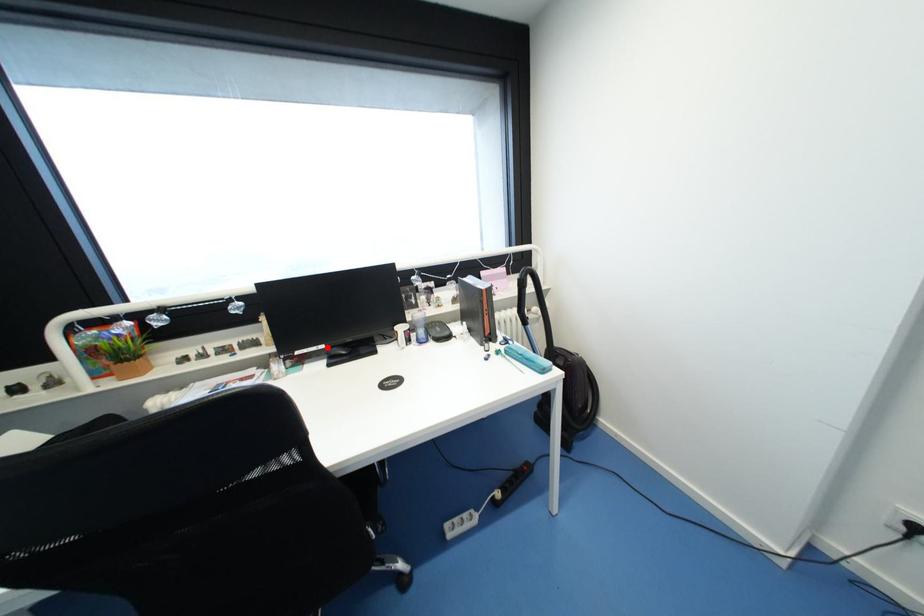
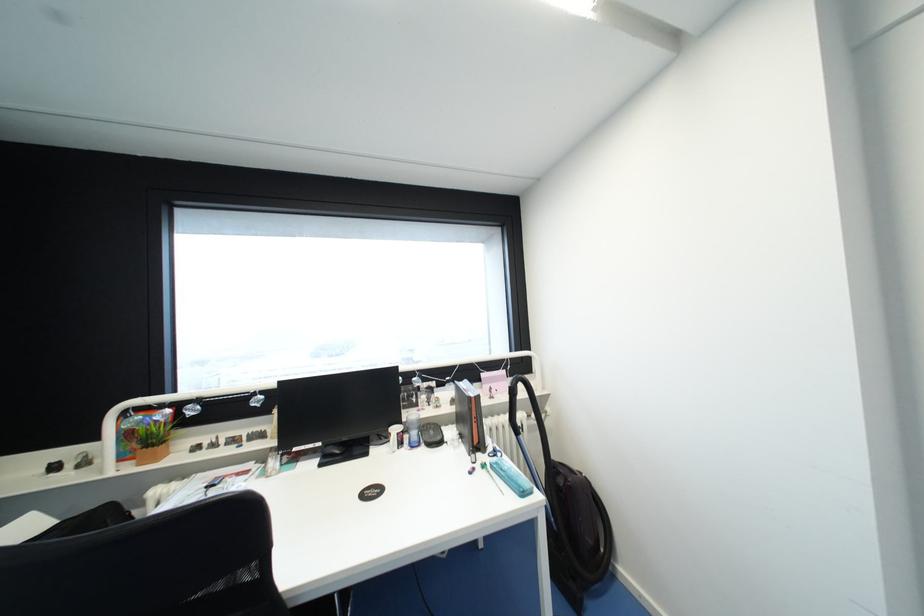
The point at the highlighted location is marked in the first image. Where is the corresponding point in the second image?

(323, 445)